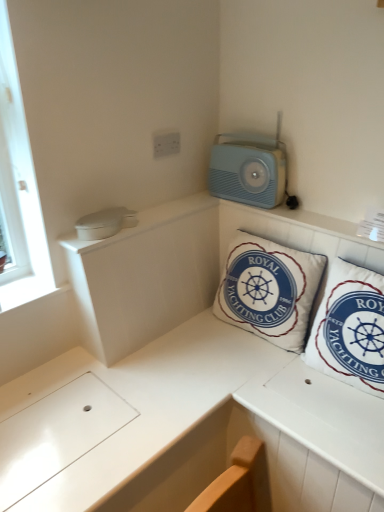
I want to click on light blue plastic radio at upper right, so click(249, 168).

This screenshot has height=512, width=384. Identify the location of light blue plastic radio at upper right. (249, 168).

Is light blue plastic radio at upper right to the right of white fabric pillow at upper right, positioned as the second pillow in left-to-right order, from the viewer's perspective?

In fact, light blue plastic radio at upper right is to the left of white fabric pillow at upper right, positioned as the second pillow in left-to-right order.

Can we say light blue plastic radio at upper right lies outside white fabric pillow at upper right, positioned as the second pillow in left-to-right order?

light blue plastic radio at upper right lies outside white fabric pillow at upper right, positioned as the second pillow in left-to-right order,'s area.

From the image's perspective, relative to white fabric pillow at upper right, positioned as the second pillow in left-to-right order, is light blue plastic radio at upper right above or below?

Clearly, from the image's perspective, light blue plastic radio at upper right is above white fabric pillow at upper right, positioned as the second pillow in left-to-right order.

From a real-world perspective, is light blue plastic radio at upper right positioned under white fabric pillow at upper right, which is the first pillow from right to left, based on gravity?

No, from a real-world perspective, light blue plastic radio at upper right is not below white fabric pillow at upper right, which is the first pillow from right to left.

Is white cotton cushion at center, the first pillow from the left, at the back of white fabric pillow at upper right, which is the first pillow from right to left?

That's not correct — white fabric pillow at upper right, which is the first pillow from right to left, is not looking away from white cotton cushion at center, the first pillow from the left.

Identify the location of pillow in front of the white cotton cushion at center, which is the 2th pillow from right to left. (350, 328).

Which is more to the right, white fabric pillow at upper right, which is the first pillow from right to left, or white cotton cushion at center, which is the 2th pillow from right to left?

From the viewer's perspective, white fabric pillow at upper right, which is the first pillow from right to left, appears more on the right side.

Is white fabric pillow at upper right, which is the first pillow from right to left, closer to camera compared to white cotton cushion at center, the first pillow from the left?

Yes, white fabric pillow at upper right, which is the first pillow from right to left, is closer to the viewer.

Can you tell me how much white plastic electric outlet at upper center and white fabric pillow at upper right, which is the first pillow from right to left, differ in facing direction?

white plastic electric outlet at upper center and white fabric pillow at upper right, which is the first pillow from right to left, are facing 90 degrees away from each other.

Which object is thinner, white plastic electric outlet at upper center or white fabric pillow at upper right, positioned as the second pillow in left-to-right order?

white plastic electric outlet at upper center is thinner.

Who is smaller, white plastic electric outlet at upper center or white fabric pillow at upper right, which is the first pillow from right to left?

Smaller between the two is white plastic electric outlet at upper center.

Is the depth of white plastic electric outlet at upper center less than that of white fabric pillow at upper right, positioned as the second pillow in left-to-right order?

No, the depth of white plastic electric outlet at upper center is greater than that of white fabric pillow at upper right, positioned as the second pillow in left-to-right order.

From a real-world perspective, which is physically below, white plastic electric outlet at upper center or white cotton cushion at center, the first pillow from the left?

In real-world perspective, white cotton cushion at center, the first pillow from the left, is lower.

Can you confirm if white plastic electric outlet at upper center is smaller than white cotton cushion at center, the first pillow from the left?

Correct, white plastic electric outlet at upper center occupies less space than white cotton cushion at center, the first pillow from the left.

Based on the photo, which object is closer to the camera taking this photo, white plastic electric outlet at upper center or white cotton cushion at center, the first pillow from the left?

Positioned in front is white cotton cushion at center, the first pillow from the left.

Is point (246, 195) closer or farther from the camera than point (155, 149)?

Clearly, point (246, 195) is more distant from the camera than point (155, 149).

Could you tell me if light blue plastic radio at upper right is turned towards white plastic electric outlet at upper center?

Yes, light blue plastic radio at upper right is aimed at white plastic electric outlet at upper center.

Looking at this image, how many degrees apart are the facing directions of light blue plastic radio at upper right and white plastic electric outlet at upper center?

There is a 89.2-degree angle between the facing directions of light blue plastic radio at upper right and white plastic electric outlet at upper center.

You are a GUI agent. You are given a task and a screenshot of the screen. Output one action in this format:
    pyautogui.click(x=<x>, y=<y>)
    Task: Click on the electric outlet above the light blue plastic radio at upper right (from the image's perspective)
    This screenshot has width=384, height=512.
    Given the screenshot: What is the action you would take?
    pyautogui.click(x=166, y=144)

From the image's perspective, is white plastic electric outlet at upper center beneath light blue plastic radio at upper right?

No, from the image's perspective, white plastic electric outlet at upper center is not beneath light blue plastic radio at upper right.

Looking at this image, is white plastic electric outlet at upper center taller than light blue plastic radio at upper right?

No.

Considering the sizes of white plastic electric outlet at upper center and light blue plastic radio at upper right in the image, is white plastic electric outlet at upper center wider or thinner than light blue plastic radio at upper right?

In the image, white plastic electric outlet at upper center appears to be more narrow than light blue plastic radio at upper right.

Would you say white plastic electric outlet at upper center is outside light blue plastic radio at upper right?

That's correct, white plastic electric outlet at upper center is outside of light blue plastic radio at upper right.

Is white cotton cushion at center, which is the 2th pillow from right to left, looking in the opposite direction of white fabric pillow at upper right, which is the first pillow from right to left?

No, white fabric pillow at upper right, which is the first pillow from right to left, is not at the back of white cotton cushion at center, which is the 2th pillow from right to left.

Considering the sizes of objects white cotton cushion at center, the first pillow from the left, and white fabric pillow at upper right, which is the first pillow from right to left, in the image provided, who is bigger, white cotton cushion at center, the first pillow from the left, or white fabric pillow at upper right, which is the first pillow from right to left,?

With larger size is white cotton cushion at center, the first pillow from the left.

Does point (297, 325) appear closer or farther from the camera than point (354, 322)?

Point (297, 325).

Where is `pillow in front of the white cotton cushion at center, which is the 2th pillow from right to left`? This screenshot has width=384, height=512. pillow in front of the white cotton cushion at center, which is the 2th pillow from right to left is located at coordinates (350, 328).

From the image's perspective, which pillow is the 2nd one below the light blue plastic radio at upper right? Please provide its 2D coordinates.

[(350, 328)]

Identify the location of pillow in front of the white cotton cushion at center, which is the 2th pillow from right to left. Image resolution: width=384 pixels, height=512 pixels. (350, 328).

When comparing their distances from white plastic electric outlet at upper center, does white fabric pillow at upper right, positioned as the second pillow in left-to-right order, or white cotton cushion at center, the first pillow from the left, seem closer?

Based on the image, white cotton cushion at center, the first pillow from the left, appears to be nearer to white plastic electric outlet at upper center.

Looking at the image, which one is located further to white cotton cushion at center, the first pillow from the left, white fabric pillow at upper right, which is the first pillow from right to left, or light blue plastic radio at upper right?

light blue plastic radio at upper right is positioned further to the anchor white cotton cushion at center, the first pillow from the left.

Which object lies nearer to the anchor point white cotton cushion at center, which is the 2th pillow from right to left, white plastic electric outlet at upper center or light blue plastic radio at upper right?

light blue plastic radio at upper right is closer to white cotton cushion at center, which is the 2th pillow from right to left.

Which object lies nearer to the anchor point white fabric pillow at upper right, positioned as the second pillow in left-to-right order, light blue plastic radio at upper right or white cotton cushion at center, which is the 2th pillow from right to left?

white cotton cushion at center, which is the 2th pillow from right to left, lies closer to white fabric pillow at upper right, positioned as the second pillow in left-to-right order, than the other object.

Which object lies further to the anchor point white plastic electric outlet at upper center, white cotton cushion at center, the first pillow from the left, or light blue plastic radio at upper right?

white cotton cushion at center, the first pillow from the left, lies further to white plastic electric outlet at upper center than the other object.

Estimate the real-world distances between objects in this image. Which object is closer to white cotton cushion at center, which is the 2th pillow from right to left, light blue plastic radio at upper right or white fabric pillow at upper right, which is the first pillow from right to left?

The object closer to white cotton cushion at center, which is the 2th pillow from right to left, is white fabric pillow at upper right, which is the first pillow from right to left.

Consider the image. When comparing their distances from white cotton cushion at center, which is the 2th pillow from right to left, does light blue plastic radio at upper right or white plastic electric outlet at upper center seem closer?

light blue plastic radio at upper right lies closer to white cotton cushion at center, which is the 2th pillow from right to left, than the other object.

When comparing their distances from light blue plastic radio at upper right, does white plastic electric outlet at upper center or white fabric pillow at upper right, which is the first pillow from right to left, seem further?

Among the two, white fabric pillow at upper right, which is the first pillow from right to left, is located further to light blue plastic radio at upper right.

The height and width of the screenshot is (512, 384). In order to click on appliance between white plastic electric outlet at upper center and white fabric pillow at upper right, which is the first pillow from right to left, from top to bottom in this screenshot , I will do `click(249, 168)`.

Find the location of `appliance between white plastic electric outlet at upper center and white cotton cushion at center, which is the 2th pillow from right to left, in the up-down direction`. appliance between white plastic electric outlet at upper center and white cotton cushion at center, which is the 2th pillow from right to left, in the up-down direction is located at coordinates (249, 168).

Locate an element on the screen. pillow between white plastic electric outlet at upper center and white fabric pillow at upper right, which is the first pillow from right to left, vertically is located at coordinates (269, 289).

Identify the location of pillow between light blue plastic radio at upper right and white fabric pillow at upper right, positioned as the second pillow in left-to-right order, from top to bottom. The image size is (384, 512). (269, 289).